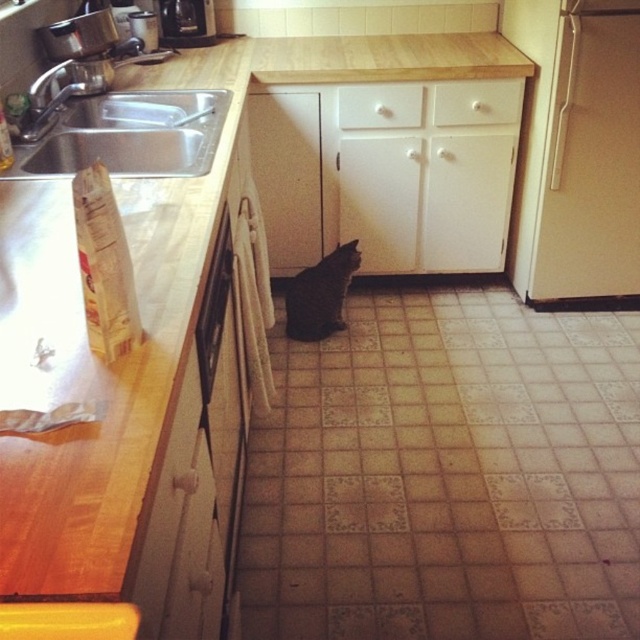
Question: Which of the following is the closest to the observer?

Choices:
 (A) white matte drawer at upper center
 (B) white matte drawer at center
 (C) brushed metal coffee maker at upper center
 (D) white matte refrigerator at right

Answer: (D)

Question: Which point is closer to the camera?

Choices:
 (A) white matte drawer at center
 (B) stainless steel sink at left

Answer: (B)

Question: Can you confirm if white matte refrigerator at right is positioned to the right of white matte drawer at upper center?

Choices:
 (A) no
 (B) yes

Answer: (B)

Question: Which of the following is the farthest from the observer?

Choices:
 (A) white matte drawer at upper center
 (B) white matte drawer at center

Answer: (B)

Question: Does white matte drawer at upper center have a smaller size compared to white matte drawer at center?

Choices:
 (A) no
 (B) yes

Answer: (A)

Question: Does white matte refrigerator at right have a larger size compared to white matte drawer at upper center?

Choices:
 (A) no
 (B) yes

Answer: (B)